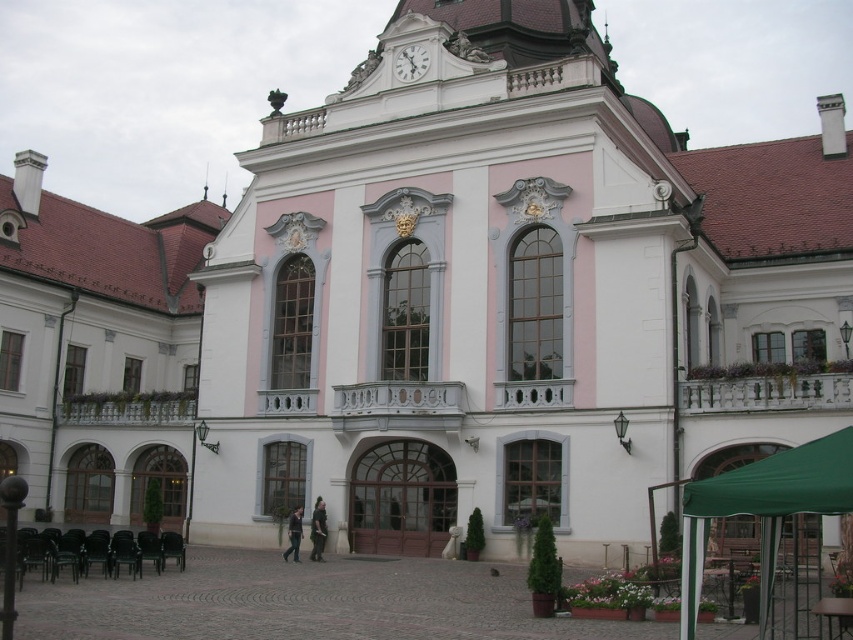
You are standing at the entrance of the building and notice the green fabric canopy at lower right and the white glossy clock at upper center. Which object is taller?

The green fabric canopy at lower right is taller than the white glossy clock at upper center according to the description.

You are planning to hang a new decorative item in the building. You have a wide tapestry that needs to be placed under the white glossy clock at upper center. Based on the existing green fabric canopy at lower right, can you estimate if the tapestry will fit under the clock without overlapping it?

The green fabric canopy at lower right might be wider than white glossy clock at upper center, so there is a possibility that the tapestry may overlap with the clock if it is similarly wide. It is recommended to check the exact dimensions before hanging.

You are standing in front of the grand building and want to locate the green fabric canopy at lower right and the white glossy clock at upper center. Which object is positioned higher in the image?

The white glossy clock at upper center is positioned higher in the image than the green fabric canopy at lower right.